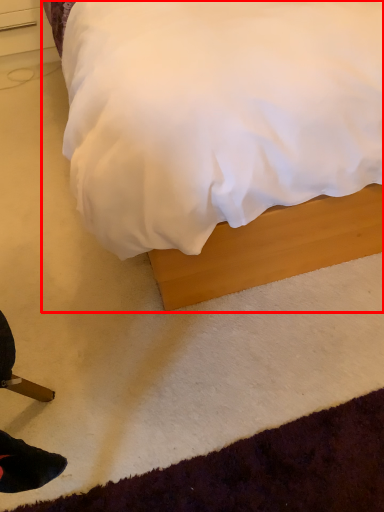
Question: Where is bed (annotated by the red box) located in relation to drawer in the image?

Choices:
 (A) right
 (B) left

Answer: (A)